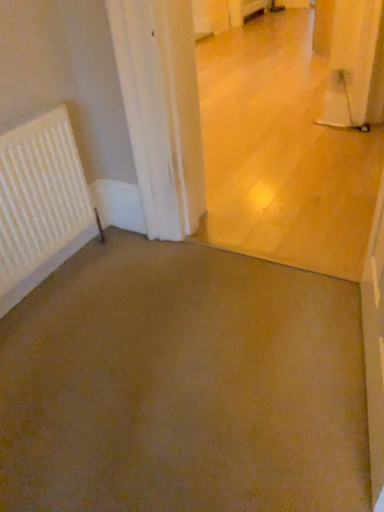
Locate an element on the screen. This screenshot has height=512, width=384. free space above brown carpet at lower left, arranged as the second concrete when viewed from the top (from a real-world perspective) is located at coordinates (191, 349).